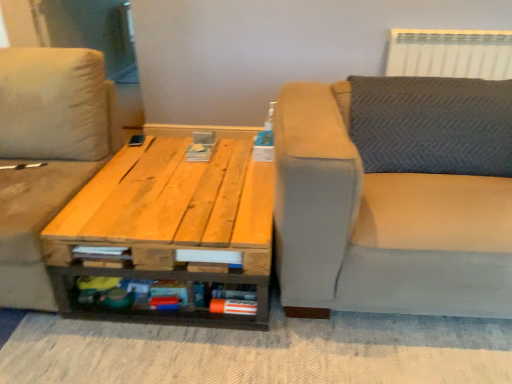
The height and width of the screenshot is (384, 512). Describe the element at coordinates (450, 53) in the screenshot. I see `white plastic radiator at upper right` at that location.

What do you see at coordinates (395, 196) in the screenshot?
I see `light gray fabric couch at right, arranged as the second studio couch when viewed from the left` at bounding box center [395, 196].

At what (x,y) coordinates should I click in order to perform the action: click on beige fabric studio couch at left, the 1th studio couch when ordered from left to right. Please return your answer as a coordinate pair (x, y). Image resolution: width=512 pixels, height=384 pixels. Looking at the image, I should click on (45, 154).

Identify the location of white plastic radiator at upper right. Image resolution: width=512 pixels, height=384 pixels. pyautogui.click(x=450, y=53).

Considering the sizes of beige fabric studio couch at left, the 1th studio couch when ordered from left to right, and light gray fabric couch at right, the first studio couch viewed from the right, in the image, is beige fabric studio couch at left, the 1th studio couch when ordered from left to right, wider or thinner than light gray fabric couch at right, the first studio couch viewed from the right,?

Clearly, beige fabric studio couch at left, the 1th studio couch when ordered from left to right, has less width compared to light gray fabric couch at right, the first studio couch viewed from the right.

Considering the relative sizes of beige fabric studio couch at left, the 1th studio couch when ordered from left to right, and light gray fabric couch at right, arranged as the second studio couch when viewed from the left, in the image provided, is beige fabric studio couch at left, the 1th studio couch when ordered from left to right, taller than light gray fabric couch at right, arranged as the second studio couch when viewed from the left,?

Yes, beige fabric studio couch at left, the 1th studio couch when ordered from left to right, is taller than light gray fabric couch at right, arranged as the second studio couch when viewed from the left.

Can you confirm if beige fabric studio couch at left, placed as the 2th studio couch when sorted from right to left, is smaller than light gray fabric couch at right, the first studio couch viewed from the right?

Correct, beige fabric studio couch at left, placed as the 2th studio couch when sorted from right to left, occupies less space than light gray fabric couch at right, the first studio couch viewed from the right.

Is beige fabric studio couch at left, placed as the 2th studio couch when sorted from right to left, oriented away from light gray fabric couch at right, arranged as the second studio couch when viewed from the left?

No, light gray fabric couch at right, arranged as the second studio couch when viewed from the left, is not at the back of beige fabric studio couch at left, placed as the 2th studio couch when sorted from right to left.

Find the location of a particular element. This screenshot has height=384, width=512. studio couch on the right of the natural wood table at center is located at coordinates (395, 196).

Can you tell me how much light gray fabric couch at right, arranged as the second studio couch when viewed from the left, and natural wood table at center differ in facing direction?

The angle between the facing direction of light gray fabric couch at right, arranged as the second studio couch when viewed from the left, and the facing direction of natural wood table at center is 1.49 degrees.

Between point (367, 178) and point (222, 178), which one is positioned behind?

Point (222, 178)

Between light gray fabric couch at right, arranged as the second studio couch when viewed from the left, and beige fabric studio couch at left, the 1th studio couch when ordered from left to right, which one is positioned in front?

light gray fabric couch at right, arranged as the second studio couch when viewed from the left.

Considering the sizes of objects light gray fabric couch at right, the first studio couch viewed from the right, and beige fabric studio couch at left, placed as the 2th studio couch when sorted from right to left, in the image provided, who is taller, light gray fabric couch at right, the first studio couch viewed from the right, or beige fabric studio couch at left, placed as the 2th studio couch when sorted from right to left,?

beige fabric studio couch at left, placed as the 2th studio couch when sorted from right to left, is taller.

Would you say light gray fabric couch at right, arranged as the second studio couch when viewed from the left, is outside beige fabric studio couch at left, placed as the 2th studio couch when sorted from right to left?

Yes, light gray fabric couch at right, arranged as the second studio couch when viewed from the left, is outside of beige fabric studio couch at left, placed as the 2th studio couch when sorted from right to left.

This screenshot has width=512, height=384. Find the location of `radiator on the right of natural wood table at center`. radiator on the right of natural wood table at center is located at coordinates (450, 53).

Between natural wood table at center and white plastic radiator at upper right, which one has less height?

With less height is white plastic radiator at upper right.

In the scene shown: Which point is more forward, (188, 182) or (455, 65)?

The point (188, 182) is more forward.

From a real-world perspective, which is physically above, natural wood table at center or white plastic radiator at upper right?

white plastic radiator at upper right is physically above.

From the image's perspective, is white plastic radiator at upper right above natural wood table at center?

Yes, from the image's perspective, white plastic radiator at upper right is over natural wood table at center.

Based on the photo, is white plastic radiator at upper right further to the viewer compared to natural wood table at center?

Yes, it is behind natural wood table at center.

From their relative heights in the image, would you say white plastic radiator at upper right is taller or shorter than natural wood table at center?

In the image, white plastic radiator at upper right appears to be shorter than natural wood table at center.

Does white plastic radiator at upper right turn towards beige fabric studio couch at left, the 1th studio couch when ordered from left to right?

No, white plastic radiator at upper right is not aimed at beige fabric studio couch at left, the 1th studio couch when ordered from left to right.

From a real-world perspective, is white plastic radiator at upper right over beige fabric studio couch at left, placed as the 2th studio couch when sorted from right to left?

Yes, from a real-world perspective, white plastic radiator at upper right is on top of beige fabric studio couch at left, placed as the 2th studio couch when sorted from right to left.

Can you tell me how much white plastic radiator at upper right and beige fabric studio couch at left, the 1th studio couch when ordered from left to right, differ in facing direction?

There is a 0.594-degree angle between the facing directions of white plastic radiator at upper right and beige fabric studio couch at left, the 1th studio couch when ordered from left to right.

Choose the correct answer: Is white plastic radiator at upper right inside beige fabric studio couch at left, placed as the 2th studio couch when sorted from right to left, or outside it?

white plastic radiator at upper right exists outside the volume of beige fabric studio couch at left, placed as the 2th studio couch when sorted from right to left.

Is natural wood table at center oriented away from beige fabric studio couch at left, the 1th studio couch when ordered from left to right?

natural wood table at center does not have its back to beige fabric studio couch at left, the 1th studio couch when ordered from left to right.

From the image's perspective, count 2nd studio couchs upward from the natural wood table at center and point to it. Please provide its 2D coordinates.

[(45, 154)]

Which of these two, natural wood table at center or beige fabric studio couch at left, placed as the 2th studio couch when sorted from right to left, is thinner?

Thinner between the two is beige fabric studio couch at left, placed as the 2th studio couch when sorted from right to left.

From the picture: Relative to beige fabric studio couch at left, placed as the 2th studio couch when sorted from right to left, is natural wood table at center in front or behind?

Visually, natural wood table at center is located behind beige fabric studio couch at left, placed as the 2th studio couch when sorted from right to left.

This screenshot has height=384, width=512. In the image, there is a light gray fabric couch at right, the first studio couch viewed from the right. Identify the location of studio couch above it (from the image's perspective). (45, 154).

Where is `table below the light gray fabric couch at right, the first studio couch viewed from the right (from the image's perspective)`? table below the light gray fabric couch at right, the first studio couch viewed from the right (from the image's perspective) is located at coordinates (168, 228).

When comparing their distances from beige fabric studio couch at left, the 1th studio couch when ordered from left to right, does light gray fabric couch at right, arranged as the second studio couch when viewed from the left, or white plastic radiator at upper right seem closer?

light gray fabric couch at right, arranged as the second studio couch when viewed from the left, lies closer to beige fabric studio couch at left, the 1th studio couch when ordered from left to right, than the other object.

Looking at the image, which one is located further to white plastic radiator at upper right, light gray fabric couch at right, the first studio couch viewed from the right, or beige fabric studio couch at left, placed as the 2th studio couch when sorted from right to left?

beige fabric studio couch at left, placed as the 2th studio couch when sorted from right to left.

Which object lies nearer to the anchor point natural wood table at center, beige fabric studio couch at left, the 1th studio couch when ordered from left to right, or light gray fabric couch at right, the first studio couch viewed from the right?

The object closer to natural wood table at center is beige fabric studio couch at left, the 1th studio couch when ordered from left to right.

When comparing their distances from white plastic radiator at upper right, does natural wood table at center or light gray fabric couch at right, the first studio couch viewed from the right, seem further?

Among the two, natural wood table at center is located further to white plastic radiator at upper right.

From the image, which object appears to be farther from white plastic radiator at upper right, beige fabric studio couch at left, placed as the 2th studio couch when sorted from right to left, or light gray fabric couch at right, the first studio couch viewed from the right?

The object further to white plastic radiator at upper right is beige fabric studio couch at left, placed as the 2th studio couch when sorted from right to left.

When comparing their distances from natural wood table at center, does light gray fabric couch at right, the first studio couch viewed from the right, or white plastic radiator at upper right seem closer?

light gray fabric couch at right, the first studio couch viewed from the right, is closer to natural wood table at center.

Based on their spatial positions, is white plastic radiator at upper right or light gray fabric couch at right, the first studio couch viewed from the right, closer to beige fabric studio couch at left, the 1th studio couch when ordered from left to right?

light gray fabric couch at right, the first studio couch viewed from the right, is closer to beige fabric studio couch at left, the 1th studio couch when ordered from left to right.

Based on their spatial positions, is beige fabric studio couch at left, placed as the 2th studio couch when sorted from right to left, or natural wood table at center further from white plastic radiator at upper right?

Based on the image, beige fabric studio couch at left, placed as the 2th studio couch when sorted from right to left, appears to be further to white plastic radiator at upper right.

This screenshot has height=384, width=512. Find the location of `studio couch between natural wood table at center and white plastic radiator at upper right`. studio couch between natural wood table at center and white plastic radiator at upper right is located at coordinates (395, 196).

At what (x,y) coordinates should I click in order to perform the action: click on table between beige fabric studio couch at left, the 1th studio couch when ordered from left to right, and light gray fabric couch at right, arranged as the second studio couch when viewed from the left, in the horizontal direction. Please return your answer as a coordinate pair (x, y). This screenshot has height=384, width=512. Looking at the image, I should click on (168, 228).

Image resolution: width=512 pixels, height=384 pixels. Find the location of `table between beige fabric studio couch at left, the 1th studio couch when ordered from left to right, and white plastic radiator at upper right from left to right`. table between beige fabric studio couch at left, the 1th studio couch when ordered from left to right, and white plastic radiator at upper right from left to right is located at coordinates (168, 228).

Identify the location of studio couch situated between beige fabric studio couch at left, the 1th studio couch when ordered from left to right, and white plastic radiator at upper right from left to right. This screenshot has width=512, height=384. (395, 196).